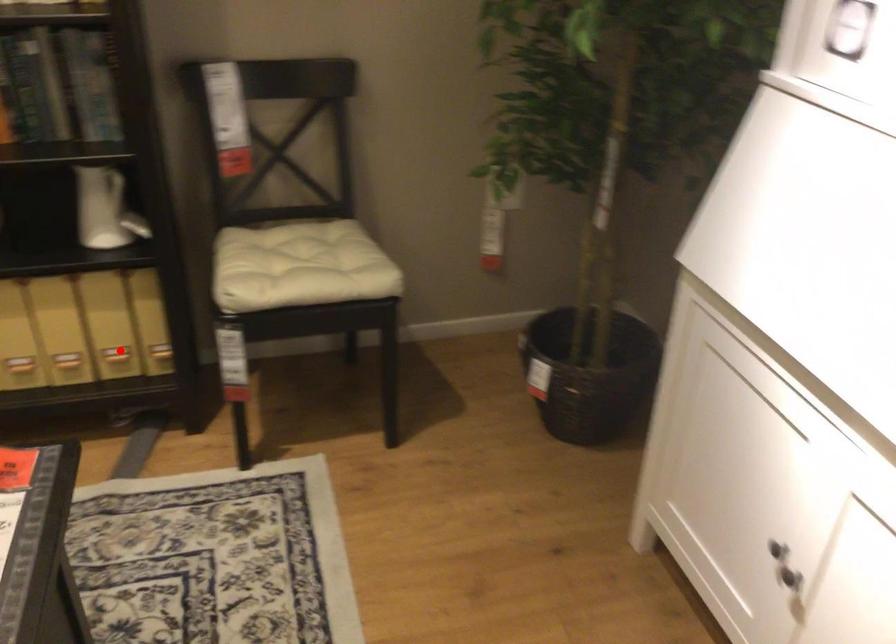
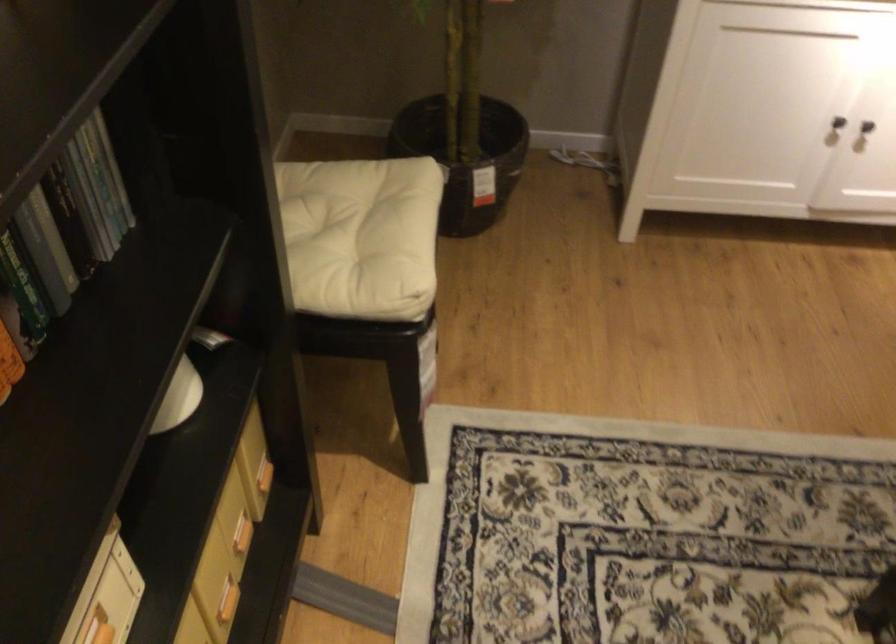
Find the pixel in the second image that matches the highlighted location in the first image.

(240, 534)